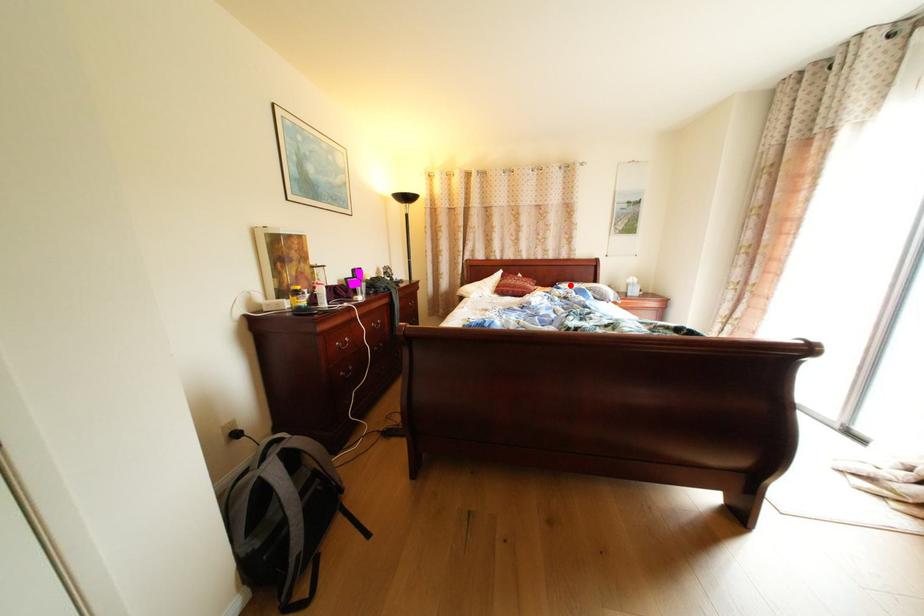
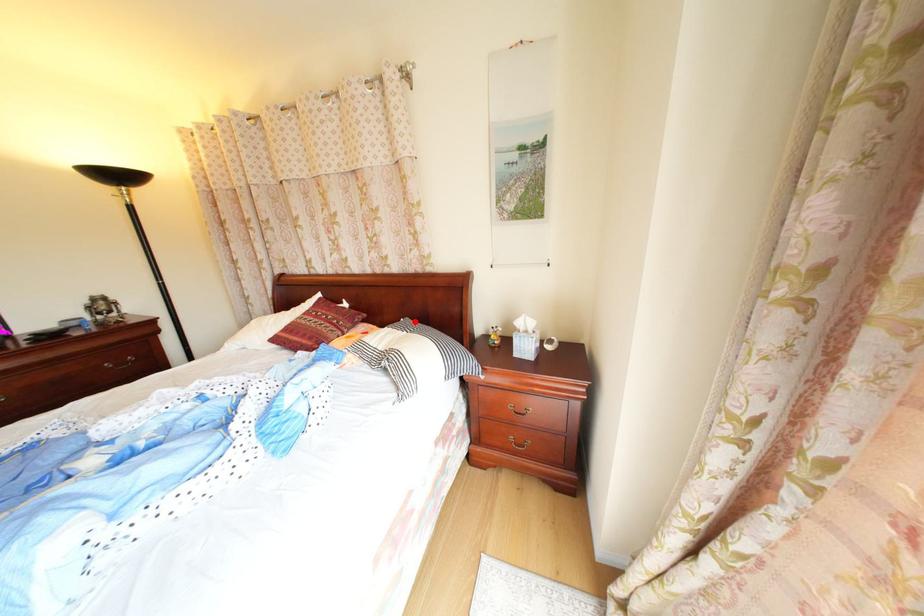
I am providing you with two images of the same scene from different viewpoints. A red point is marked on the first image and another point is marked on the second image. Are the points marked in image1 and image2 representing the same 3D position?

Yes